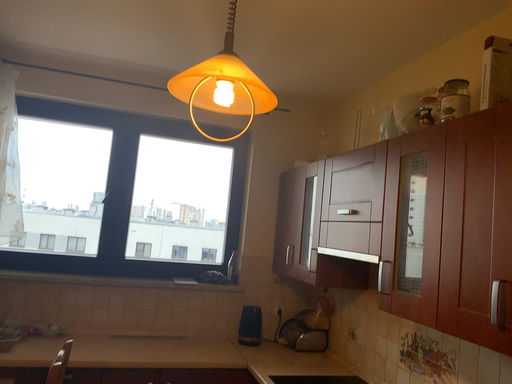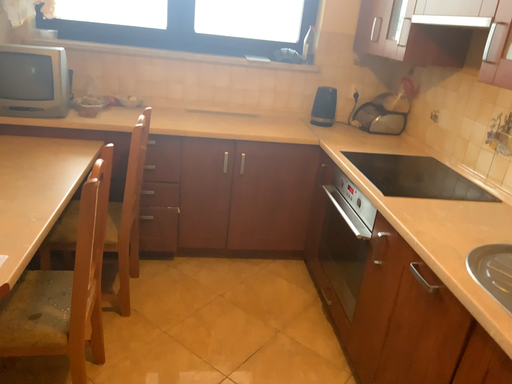
Question: How did the camera likely rotate when shooting the video?

Choices:
 (A) rotated upward
 (B) rotated downward

Answer: (B)